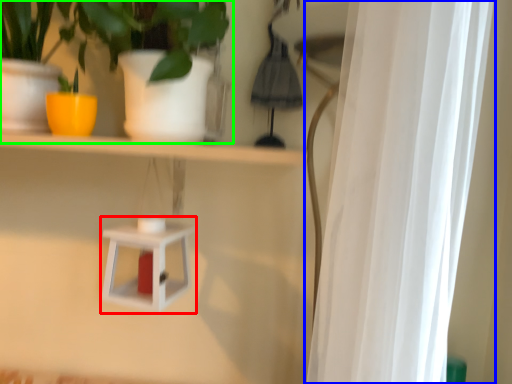
Question: Which is nearer to the shelf (highlighted by a red box)? curtain (highlighted by a blue box) or houseplant (highlighted by a green box).

Choices:
 (A) curtain
 (B) houseplant

Answer: (B)